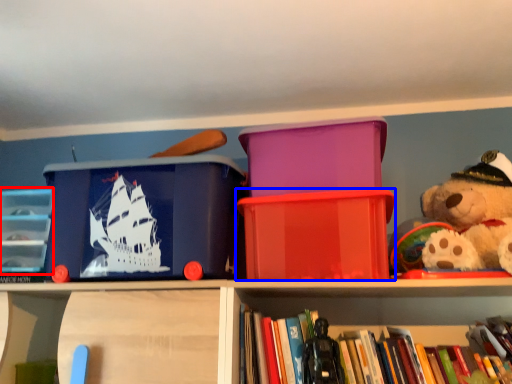
Question: Which object appears farthest to the camera in this image, shelf (highlighted by a red box) or storage box (highlighted by a blue box)?

Choices:
 (A) shelf
 (B) storage box

Answer: (A)